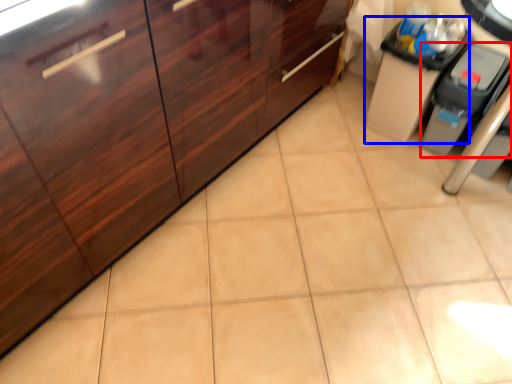
Question: Which object is closer to the camera taking this photo, appliance (highlighted by a red box) or cabinetry (highlighted by a blue box)?

Choices:
 (A) appliance
 (B) cabinetry

Answer: (A)